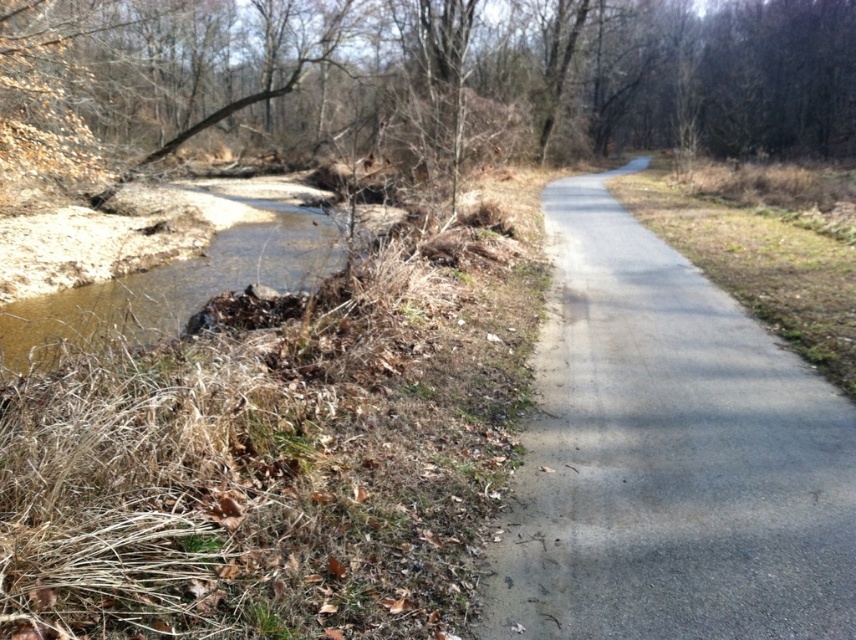
Can you confirm if brown leafy tree at upper left is positioned to the right of gray asphalt trail at center?

No, brown leafy tree at upper left is not to the right of gray asphalt trail at center.

This screenshot has height=640, width=856. Find the location of `brown leafy tree at upper left`. brown leafy tree at upper left is located at coordinates [418, 81].

Where is `brown leafy tree at upper left`? brown leafy tree at upper left is located at coordinates tap(418, 81).